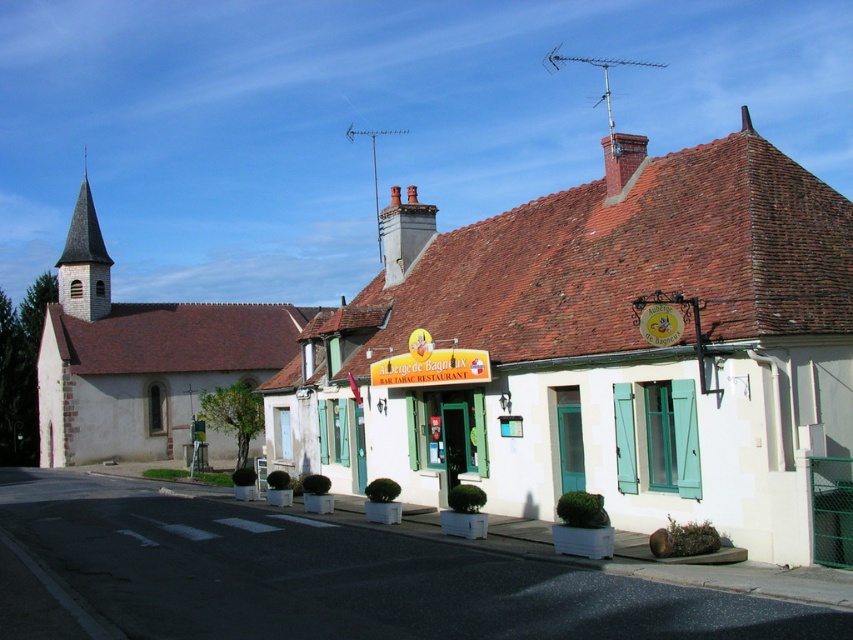
Question: Is white painted wood church at center thinner than stone church at left?

Choices:
 (A) no
 (B) yes

Answer: (A)

Question: Which object appears closest to the camera in this image?

Choices:
 (A) white painted wood church at center
 (B) stone church at left
 (C) smooth gray steeple at left

Answer: (A)

Question: Can you confirm if white painted wood church at center is positioned to the left of smooth gray steeple at left?

Choices:
 (A) yes
 (B) no

Answer: (B)

Question: Which point is closer to the camera?

Choices:
 (A) (51, 428)
 (B) (781, 282)
 (C) (78, 291)

Answer: (B)

Question: Is white painted wood church at center above smooth gray steeple at left?

Choices:
 (A) no
 (B) yes

Answer: (B)

Question: Which of the following is the closest to the observer?

Choices:
 (A) white painted wood church at center
 (B) smooth gray steeple at left
 (C) stone church at left

Answer: (A)